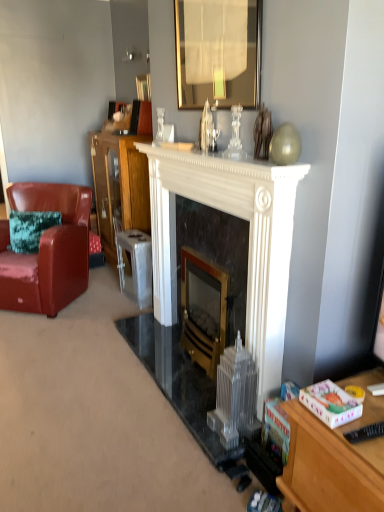
Question: From a real-world perspective, is black plastic remote control at lower right positioned under gold-framed mirror at upper center based on gravity?

Choices:
 (A) yes
 (B) no

Answer: (A)

Question: Does black plastic remote control at lower right turn towards gold-framed mirror at upper center?

Choices:
 (A) no
 (B) yes

Answer: (A)

Question: Does black plastic remote control at lower right touch gold-framed mirror at upper center?

Choices:
 (A) yes
 (B) no

Answer: (B)

Question: Is black plastic remote control at lower right wider than gold-framed mirror at upper center?

Choices:
 (A) yes
 (B) no

Answer: (A)

Question: Is black plastic remote control at lower right further to camera compared to gold-framed mirror at upper center?

Choices:
 (A) no
 (B) yes

Answer: (A)

Question: In terms of width, does black plastic remote control at lower right look wider or thinner when compared to black marble fireplace at center, the second fireplace from the left?

Choices:
 (A) thin
 (B) wide

Answer: (B)

Question: From a real-world perspective, is black plastic remote control at lower right above or below black marble fireplace at center, the second fireplace from the left?

Choices:
 (A) above
 (B) below

Answer: (A)

Question: Choose the correct answer: Is black plastic remote control at lower right inside black marble fireplace at center, the second fireplace from the left, or outside it?

Choices:
 (A) outside
 (B) inside

Answer: (A)

Question: From their relative heights in the image, would you say black plastic remote control at lower right is taller or shorter than black marble fireplace at center, the second fireplace from the left?

Choices:
 (A) short
 (B) tall

Answer: (A)

Question: Would you say white marble fireplace at center is to the left or to the right of glossy ceramic coffee cup at upper center in the picture?

Choices:
 (A) left
 (B) right

Answer: (B)

Question: Is white marble fireplace at center inside or outside of glossy ceramic coffee cup at upper center?

Choices:
 (A) inside
 (B) outside

Answer: (B)

Question: Considering their positions, is white marble fireplace at center located in front of or behind glossy ceramic coffee cup at upper center?

Choices:
 (A) front
 (B) behind

Answer: (A)

Question: From their relative heights in the image, would you say white marble fireplace at center is taller or shorter than glossy ceramic coffee cup at upper center?

Choices:
 (A) tall
 (B) short

Answer: (B)

Question: Is wooden cabinet at center bigger or smaller than metallic silver stool at center?

Choices:
 (A) small
 (B) big

Answer: (B)

Question: From a real-world perspective, is wooden cabinet at center positioned above or below metallic silver stool at center?

Choices:
 (A) above
 (B) below

Answer: (A)